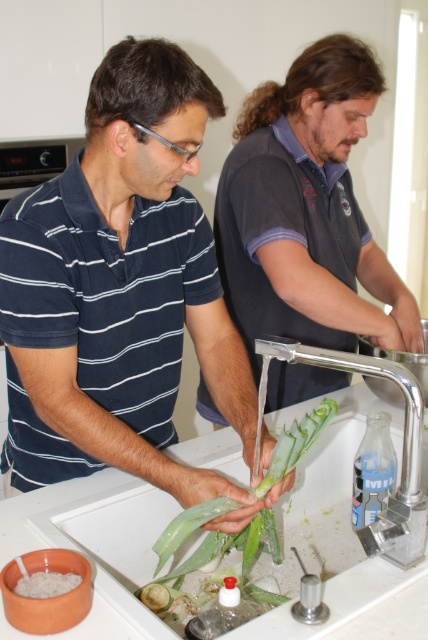
Which of these two, white ceramic sink at lower center or green leafy vegetable at center, stands shorter?

green leafy vegetable at center is shorter.

Between white ceramic sink at lower center and green leafy vegetable at center, which one has more height?

With more height is white ceramic sink at lower center.

Where is `white ceramic sink at lower center`? white ceramic sink at lower center is located at coordinates [115, 544].

Image resolution: width=428 pixels, height=640 pixels. I want to click on white ceramic sink at lower center, so click(115, 544).

Which of these two, white ceramic sink at lower center or transparent plastic aloe vera at lower right, stands shorter?

transparent plastic aloe vera at lower right is shorter.

Which is behind, point (115, 524) or point (359, 515)?

The point (359, 515) is more distant.

Identify the location of white ceramic sink at lower center. (115, 544).

Does chrome metallic faucet at upper right appear over white matte rice at lower left?

Yes.

What are the coordinates of `chrome metallic faucet at upper right` in the screenshot? It's located at (401, 454).